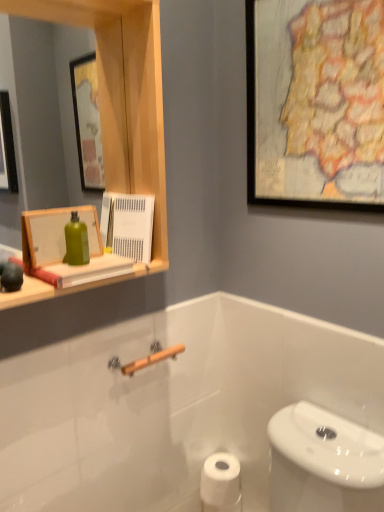
Question: Is wooden medicine cabinet at upper left in front of white matte toilet paper at lower center?

Choices:
 (A) yes
 (B) no

Answer: (A)

Question: Considering the relative sizes of wooden medicine cabinet at upper left and white matte toilet paper at lower center in the image provided, is wooden medicine cabinet at upper left thinner than white matte toilet paper at lower center?

Choices:
 (A) yes
 (B) no

Answer: (A)

Question: From a real-world perspective, is wooden medicine cabinet at upper left under white matte toilet paper at lower center?

Choices:
 (A) no
 (B) yes

Answer: (A)

Question: From the image's perspective, would you say wooden medicine cabinet at upper left is shown under white matte toilet paper at lower center?

Choices:
 (A) yes
 (B) no

Answer: (B)

Question: Is wooden medicine cabinet at upper left facing away from white matte toilet paper at lower center?

Choices:
 (A) yes
 (B) no

Answer: (B)

Question: In terms of width, does wooden medicine cabinet at upper left look wider or thinner when compared to wooden framed map at upper right, positioned as the second picture frame in bottom-to-top order?

Choices:
 (A) wide
 (B) thin

Answer: (A)

Question: From a real-world perspective, is wooden medicine cabinet at upper left positioned above or below wooden framed map at upper right, which ranks as the first picture frame in top-to-bottom order?

Choices:
 (A) above
 (B) below

Answer: (B)

Question: From the image's perspective, is wooden medicine cabinet at upper left positioned above or below wooden framed map at upper right, which ranks as the first picture frame in top-to-bottom order?

Choices:
 (A) below
 (B) above

Answer: (A)

Question: Considering the positions of wooden medicine cabinet at upper left and wooden framed map at upper right, the first picture frame viewed from the right, in the image, is wooden medicine cabinet at upper left taller or shorter than wooden framed map at upper right, the first picture frame viewed from the right,?

Choices:
 (A) short
 (B) tall

Answer: (B)

Question: Choose the correct answer: Is wooden medicine cabinet at upper left inside wooden picture frame at upper left, positioned as the 1th picture frame in bottom-to-top order, or outside it?

Choices:
 (A) outside
 (B) inside

Answer: (A)

Question: Relative to wooden picture frame at upper left, which is the 1th picture frame in left-to-right order, is wooden medicine cabinet at upper left in front or behind?

Choices:
 (A) behind
 (B) front

Answer: (B)

Question: From their relative heights in the image, would you say wooden medicine cabinet at upper left is taller or shorter than wooden picture frame at upper left, the second picture frame when ordered from right to left?

Choices:
 (A) short
 (B) tall

Answer: (B)

Question: Looking at their shapes, would you say wooden medicine cabinet at upper left is wider or thinner than wooden picture frame at upper left, the second picture frame when ordered from right to left?

Choices:
 (A) thin
 (B) wide

Answer: (B)

Question: Looking at the image, does wooden picture frame at upper left, which is the 1th picture frame in left-to-right order, seem bigger or smaller compared to wooden framed map at upper right, which ranks as the first picture frame in top-to-bottom order?

Choices:
 (A) small
 (B) big

Answer: (A)

Question: Is point (41, 216) positioned closer to the camera than point (319, 71)?

Choices:
 (A) farther
 (B) closer

Answer: (B)